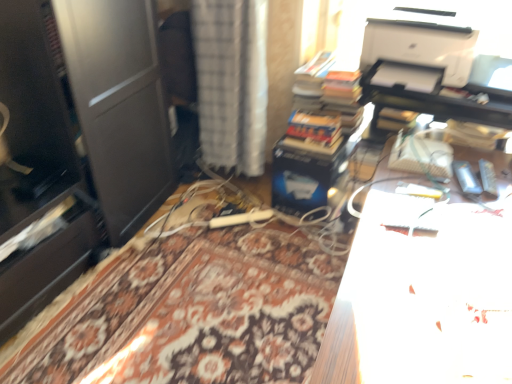
Question: Is white matte printer at upper right at the left side of white textured curtain at center?

Choices:
 (A) yes
 (B) no

Answer: (B)

Question: Is the position of white matte printer at upper right more distant than that of white textured curtain at center?

Choices:
 (A) yes
 (B) no

Answer: (B)

Question: From a real-world perspective, is white matte printer at upper right below white textured curtain at center?

Choices:
 (A) no
 (B) yes

Answer: (A)

Question: Is white matte printer at upper right positioned with its back to white textured curtain at center?

Choices:
 (A) yes
 (B) no

Answer: (B)

Question: Are white matte printer at upper right and white textured curtain at center located far from each other?

Choices:
 (A) no
 (B) yes

Answer: (A)

Question: Is white matte printer at upper right to the right of white textured curtain at center from the viewer's perspective?

Choices:
 (A) yes
 (B) no

Answer: (A)

Question: Considering the relative sizes of white textured curtain at center and hardcover books at center in the image provided, is white textured curtain at center taller than hardcover books at center?

Choices:
 (A) yes
 (B) no

Answer: (A)

Question: From a real-world perspective, is white textured curtain at center located beneath hardcover books at center?

Choices:
 (A) yes
 (B) no

Answer: (A)

Question: Does white textured curtain at center lie behind hardcover books at center?

Choices:
 (A) yes
 (B) no

Answer: (B)

Question: Would you say white textured curtain at center is outside hardcover books at center?

Choices:
 (A) yes
 (B) no

Answer: (A)

Question: Is white textured curtain at center far away from hardcover books at center?

Choices:
 (A) yes
 (B) no

Answer: (B)

Question: Does white textured curtain at center have a lesser width compared to hardcover books at center?

Choices:
 (A) yes
 (B) no

Answer: (A)

Question: Is white matte printer at upper right next to hardcover books at center?

Choices:
 (A) yes
 (B) no

Answer: (B)